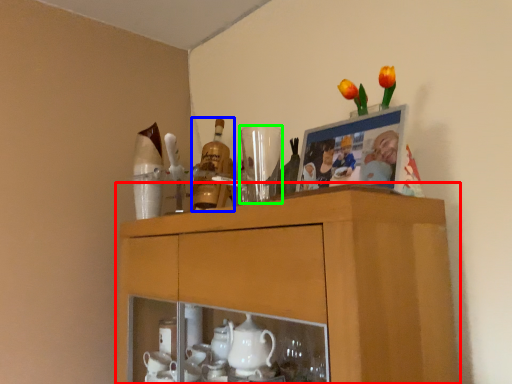
Question: Which is nearer to the cabinetry (highlighted by a red box)? bottle (highlighted by a blue box) or tableware (highlighted by a green box).

Choices:
 (A) bottle
 (B) tableware

Answer: (B)